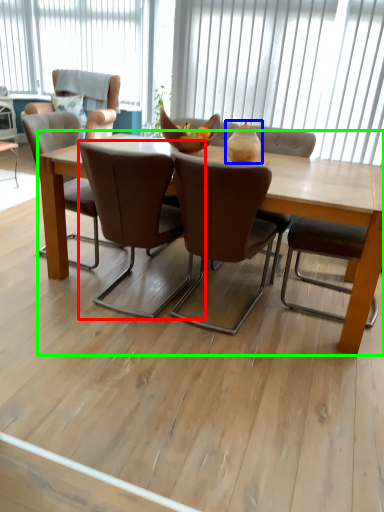
Question: Which object is positioned closest to chair (highlighted by a red box)? Select from vase (highlighted by a blue box) and coffee table (highlighted by a green box).

Choices:
 (A) vase
 (B) coffee table

Answer: (A)